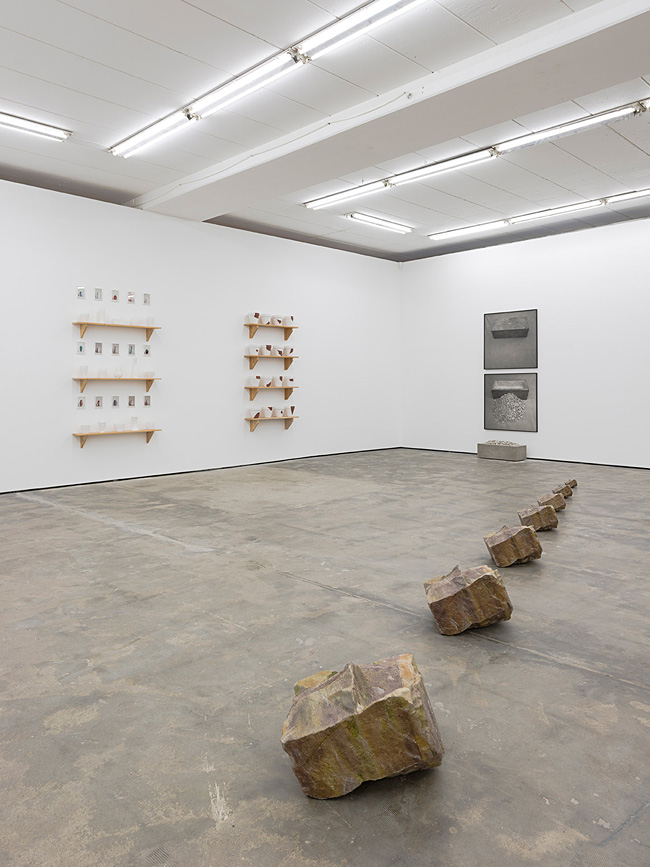
Locate an element on the screen. The width and height of the screenshot is (650, 867). floor is located at coordinates (300, 587).